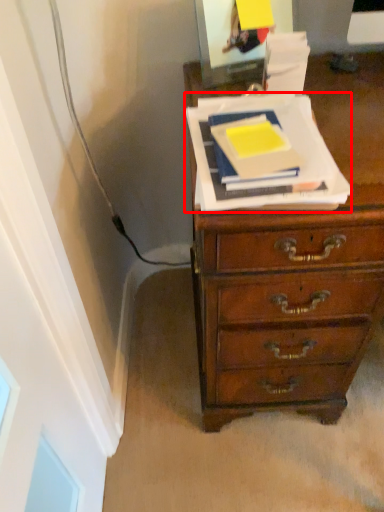
Question: In this image, where is paperback book (annotated by the red box) located relative to paperback book?

Choices:
 (A) left
 (B) right

Answer: (B)